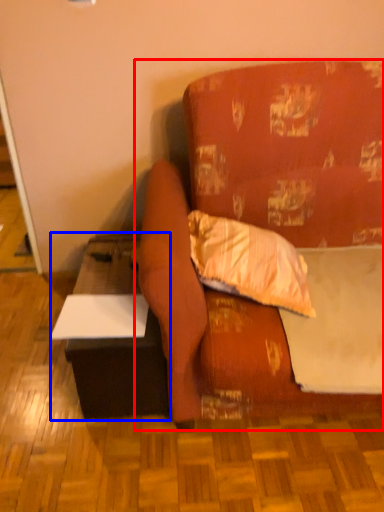
Question: Among these objects, which one is farthest to the camera, studio couch (highlighted by a red box) or table (highlighted by a blue box)?

Choices:
 (A) studio couch
 (B) table

Answer: (B)